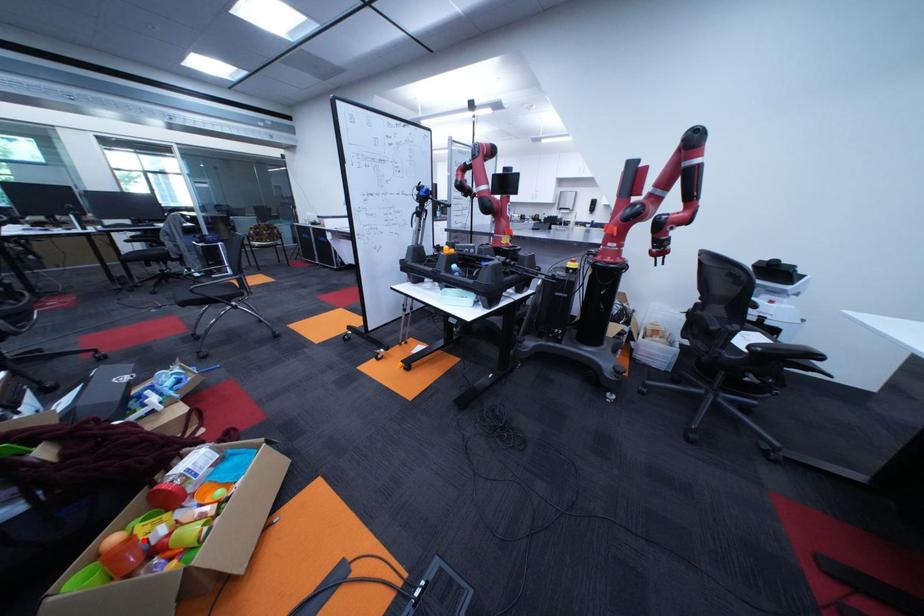
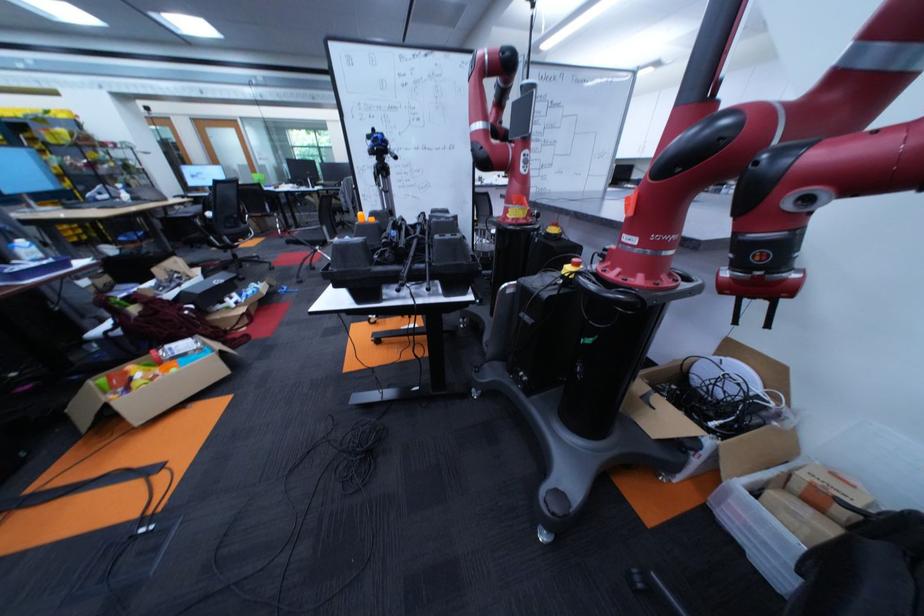
Find the pixel in the second image that matches the highlighted location in the first image.

(140, 371)